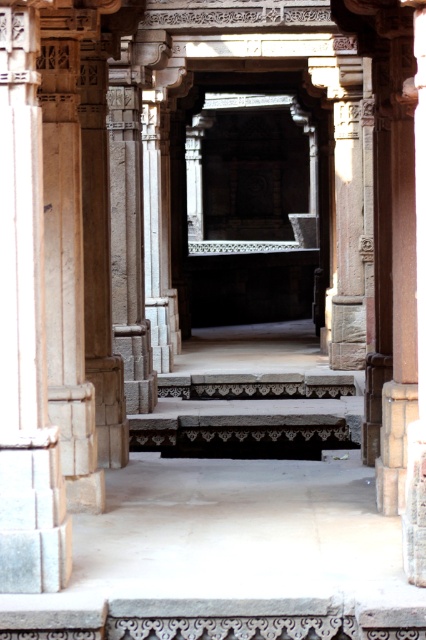
Question: In this image, where is gray stone pillar at left located relative to dark gray stone stairs at center?

Choices:
 (A) below
 (B) above

Answer: (B)

Question: Which point is closer to the camera?

Choices:
 (A) (203, 381)
 (B) (25, 467)

Answer: (B)

Question: Which object is closer to the camera taking this photo?

Choices:
 (A) dark gray stone stairs at center
 (B) gray stone pillar at left

Answer: (B)

Question: Does gray stone pillar at left appear on the left side of dark gray stone stairs at center?

Choices:
 (A) yes
 (B) no

Answer: (A)

Question: Does gray stone pillar at left appear under dark gray stone stairs at center?

Choices:
 (A) no
 (B) yes

Answer: (A)